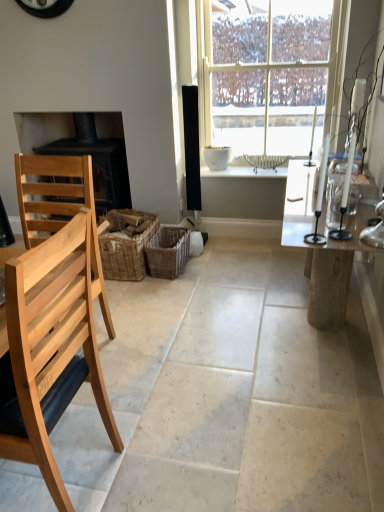
Find the location of `free space between clear glass table at right and woven brown basket at center, which appears as the 2th crate when viewed from the right`. free space between clear glass table at right and woven brown basket at center, which appears as the 2th crate when viewed from the right is located at coordinates (221, 294).